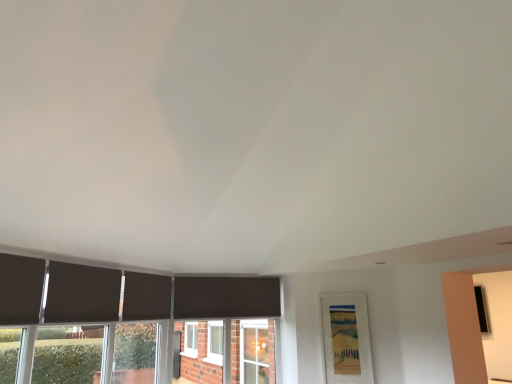
Question: Considering the relative sizes of dark matte curtain at lower left, the second curtain positioned from the front, and matte black curtain at center, the first curtain viewed from the right, in the image provided, is dark matte curtain at lower left, the second curtain positioned from the front, wider than matte black curtain at center, the first curtain viewed from the right,?

Choices:
 (A) no
 (B) yes

Answer: (A)

Question: From a real-world perspective, is dark matte curtain at lower left, arranged as the 2th curtain when viewed from the right, located higher than matte black curtain at center, which is counted as the first curtain, starting from the back?

Choices:
 (A) no
 (B) yes

Answer: (A)

Question: Is dark matte curtain at lower left, acting as the second curtain starting from the left, behind matte black curtain at center, the 3th curtain viewed from the left?

Choices:
 (A) no
 (B) yes

Answer: (A)

Question: Considering the relative sizes of dark matte curtain at lower left, acting as the second curtain starting from the left, and matte black curtain at center, the 3th curtain viewed from the left, in the image provided, is dark matte curtain at lower left, acting as the second curtain starting from the left, thinner than matte black curtain at center, the 3th curtain viewed from the left,?

Choices:
 (A) yes
 (B) no

Answer: (A)

Question: From a real-world perspective, does dark matte curtain at lower left, arranged as the 2th curtain when viewed from the right, sit lower than matte black curtain at center, the first curtain viewed from the right?

Choices:
 (A) yes
 (B) no

Answer: (A)

Question: Is dark matte curtain at lower left, the second curtain positioned from the front, smaller than matte black curtain at center, the third curtain viewed from the front?

Choices:
 (A) no
 (B) yes

Answer: (B)

Question: From a real-world perspective, is matte black curtain at center, which is counted as the first curtain, starting from the back, under dark matte curtain at lower left, acting as the second curtain starting from the left?

Choices:
 (A) no
 (B) yes

Answer: (A)

Question: Is matte black curtain at center, the 3th curtain viewed from the left, positioned in front of dark matte curtain at lower left, which is counted as the 2th curtain, starting from the back?

Choices:
 (A) no
 (B) yes

Answer: (A)

Question: From the image's perspective, is matte black curtain at center, the 3th curtain viewed from the left, below dark matte curtain at lower left, arranged as the 2th curtain when viewed from the right?

Choices:
 (A) no
 (B) yes

Answer: (B)

Question: Can dark matte curtain at lower left, the second curtain positioned from the front, be found inside matte black curtain at center, the third curtain viewed from the front?

Choices:
 (A) yes
 (B) no

Answer: (B)

Question: Considering the relative sizes of matte black curtain at center, the third curtain viewed from the front, and dark matte curtain at lower left, which is counted as the 2th curtain, starting from the back, in the image provided, is matte black curtain at center, the third curtain viewed from the front, bigger than dark matte curtain at lower left, which is counted as the 2th curtain, starting from the back,?

Choices:
 (A) yes
 (B) no

Answer: (A)

Question: Does matte black curtain at center, which is counted as the first curtain, starting from the back, have a greater height compared to dark matte curtain at lower left, which is counted as the 2th curtain, starting from the back?

Choices:
 (A) no
 (B) yes

Answer: (B)

Question: Is dark matte curtain at lower left, acting as the second curtain starting from the left, surrounding dark matte curtain at left, arranged as the 1th curtain when viewed from the left?

Choices:
 (A) yes
 (B) no

Answer: (B)